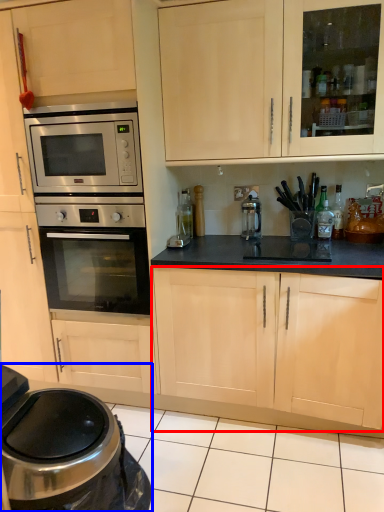
Question: Which object is closer to the camera taking this photo, cabinetry (highlighted by a red box) or home appliance (highlighted by a blue box)?

Choices:
 (A) cabinetry
 (B) home appliance

Answer: (B)